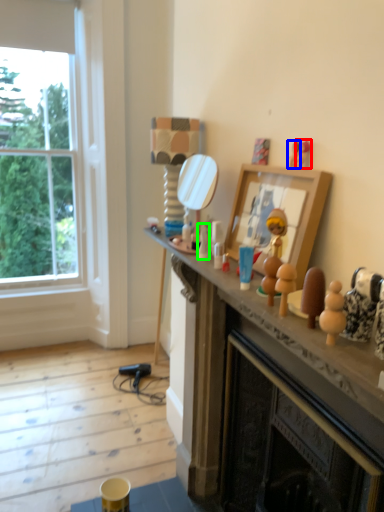
Question: Which is farther away from toy (highlighted by a red box)? toy (highlighted by a blue box) or toy (highlighted by a green box)?

Choices:
 (A) toy
 (B) toy

Answer: (B)